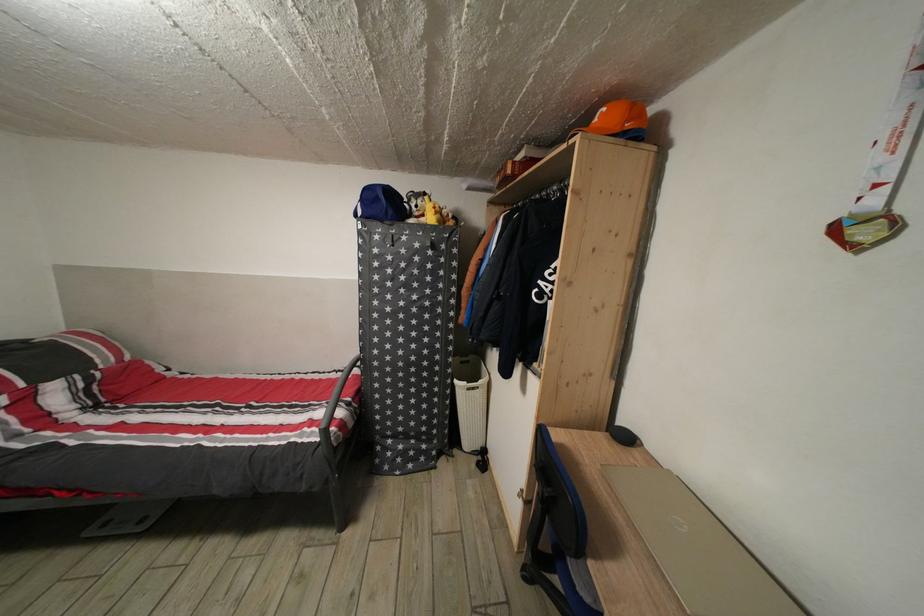
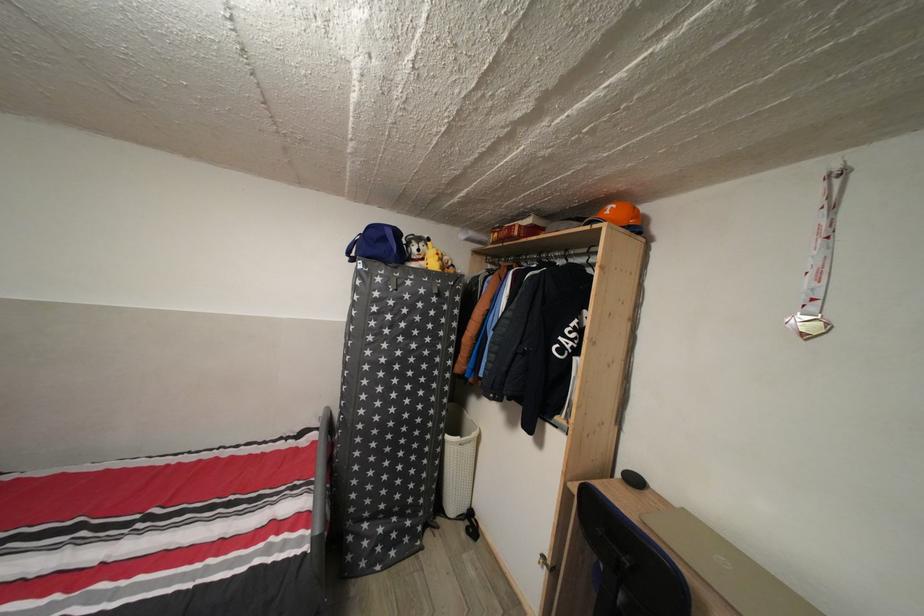
Find the pixel in the second image that matches the point at 384,205 in the first image.

(391, 246)